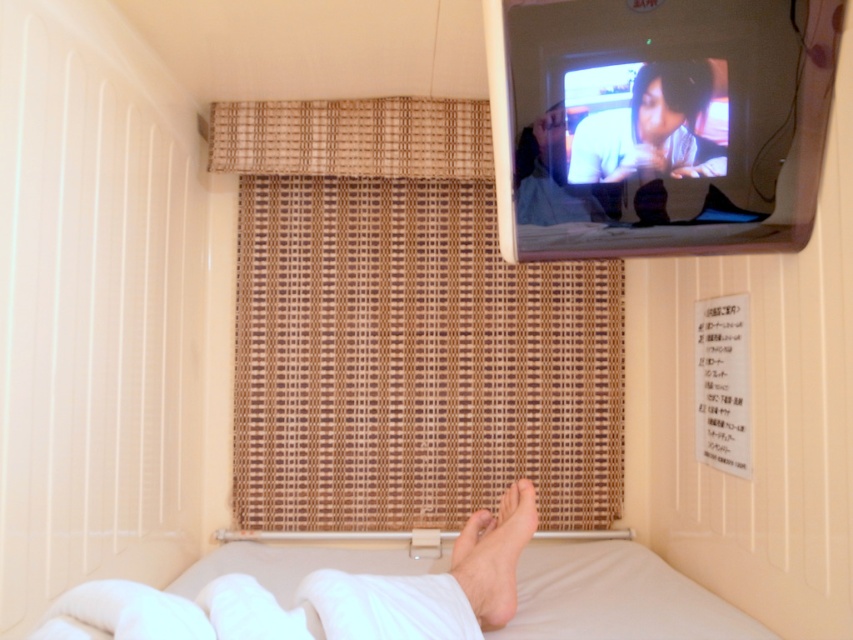
You are a guest in the capsule hotel room and want to make sure your feet are covered while sleeping. The white soft foot at lower center is visible. Is the white soft bed at lower center long enough to cover your feet?

The white soft bed at lower center is positioned under the white soft foot at lower center, which means the bed is placed below the foot area. This suggests the bed might not extend far enough to fully cover the feet, so it may not be long enough to cover your feet while sleeping.

You are a guest in the capsule hotel room. You want to watch the movie on the TV but need to adjust the angle of the bamboo blind to get a better view. Which object should you move first, the matte black shirt at upper right or the white soft foot at lower center?

You should move the matte black shirt at upper right first because it is located above the white soft foot at lower center and might be blocking the view to the TV.

You are standing in a capsule hotel room and want to place a small nightlight on the floor. The nightlight requires a space of 0.1 units in width and height. Is there enough space between the white soft foot at lower center and the wall to place it?

The white soft foot at lower center is located at point (494, 554). Since the nightlight requires 0.1 units of space, there should be sufficient space between the foot and the wall to place it as long as the coordinates allow for the necessary clearance.